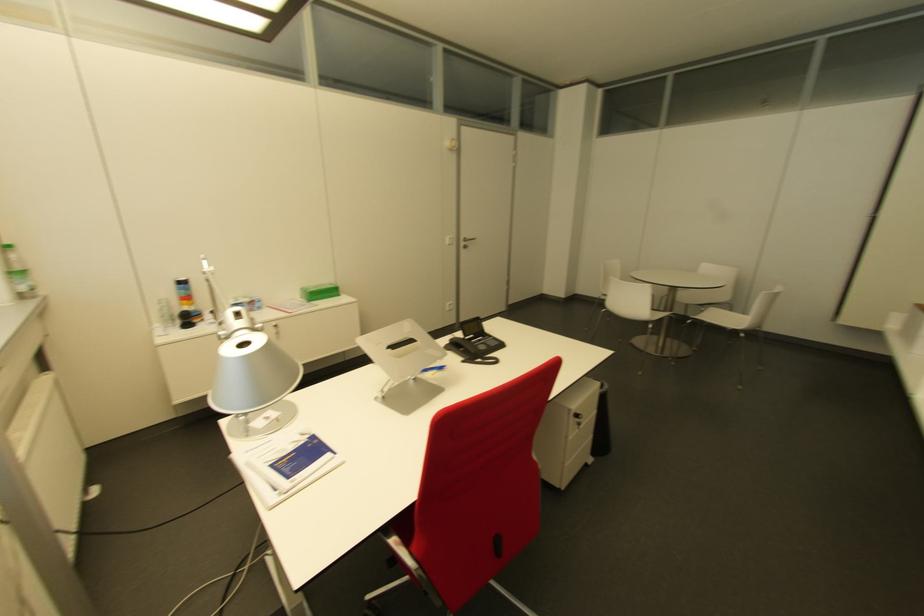
Find where to lift the black phone receiver. Please return your answer as a coordinate pair (x, y).

(464, 347)